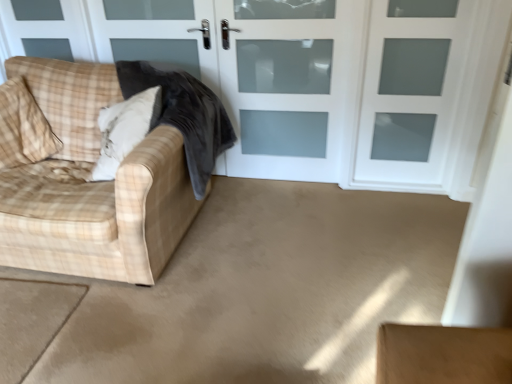
Question: Considering the relative sizes of plush white pillow at left, the second pillow from the left, and velvet dark gray blanket at left in the image provided, is plush white pillow at left, the second pillow from the left, shorter than velvet dark gray blanket at left?

Choices:
 (A) no
 (B) yes

Answer: (B)

Question: Does plush white pillow at left, which is the first pillow in right-to-left order, have a greater height compared to velvet dark gray blanket at left?

Choices:
 (A) no
 (B) yes

Answer: (A)

Question: Is plush white pillow at left, the second pillow from the left, to the right of velvet dark gray blanket at left from the viewer's perspective?

Choices:
 (A) no
 (B) yes

Answer: (A)

Question: Is plush white pillow at left, which is the first pillow in right-to-left order, aimed at velvet dark gray blanket at left?

Choices:
 (A) no
 (B) yes

Answer: (B)

Question: Does plush white pillow at left, which is the first pillow in right-to-left order, have a greater width compared to velvet dark gray blanket at left?

Choices:
 (A) yes
 (B) no

Answer: (B)

Question: Is plush white pillow at left, the second pillow from the left, not inside velvet dark gray blanket at left?

Choices:
 (A) yes
 (B) no

Answer: (B)

Question: Is white frosted glass screen door at upper center, which is counted as the 1th screen door, starting from the right, facing away from white frosted glass door at center, which ranks as the first screen door in left-to-right order?

Choices:
 (A) yes
 (B) no

Answer: (B)

Question: Does white frosted glass screen door at upper center, placed as the 2th screen door when sorted from left to right, have a lesser width compared to white frosted glass door at center, which ranks as the first screen door in left-to-right order?

Choices:
 (A) no
 (B) yes

Answer: (A)

Question: From a real-world perspective, is white frosted glass screen door at upper center, placed as the 2th screen door when sorted from left to right, physically above white frosted glass door at center, marked as the 2th screen door in a right-to-left arrangement?

Choices:
 (A) no
 (B) yes

Answer: (A)

Question: Is white frosted glass screen door at upper center, which is counted as the 1th screen door, starting from the right, placed right next to white frosted glass door at center, marked as the 2th screen door in a right-to-left arrangement?

Choices:
 (A) no
 (B) yes

Answer: (A)

Question: Is white frosted glass screen door at upper center, which is counted as the 1th screen door, starting from the right, outside white frosted glass door at center, marked as the 2th screen door in a right-to-left arrangement?

Choices:
 (A) no
 (B) yes

Answer: (B)

Question: Considering the relative positions of white frosted glass screen door at upper center, which is counted as the 1th screen door, starting from the right, and white frosted glass door at center, which ranks as the first screen door in left-to-right order, in the image provided, is white frosted glass screen door at upper center, which is counted as the 1th screen door, starting from the right, behind white frosted glass door at center, which ranks as the first screen door in left-to-right order,?

Choices:
 (A) yes
 (B) no

Answer: (B)

Question: From the image's perspective, is white frosted glass screen door at upper center, which is counted as the 1th screen door, starting from the right, over plush white pillow at left, which is the first pillow in right-to-left order?

Choices:
 (A) no
 (B) yes

Answer: (B)